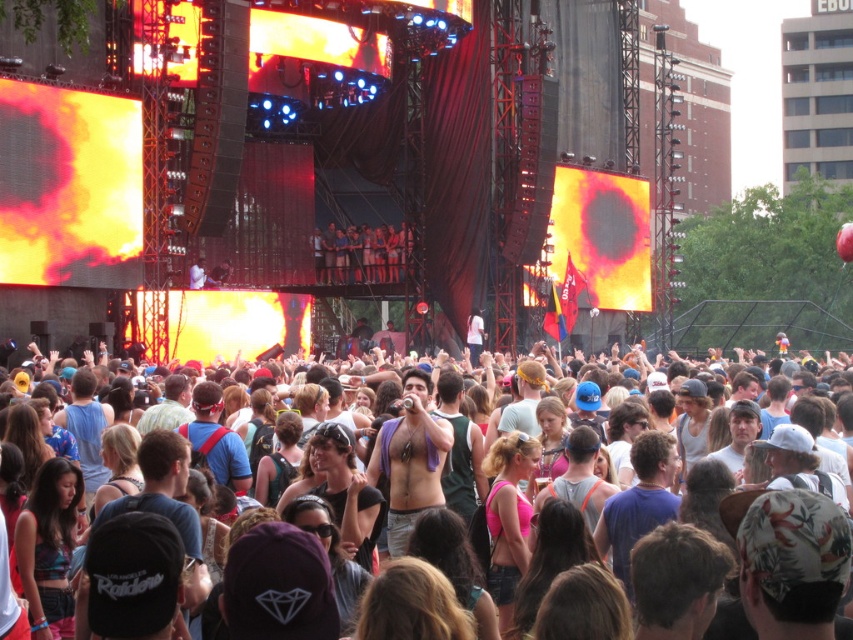
You are a photographer at the concert and want to take a photo of the multicolored casual attire at center and the matte black camera at upper center. Which object should you focus on first if you want to capture both in a single shot without moving the camera?

The multicolored casual attire at center is taller than the matte black camera at upper center, so you should focus on the multicolored casual attire at center first to ensure both objects are in frame.

From the picture: You are a photographer standing at the position of the matte black camera at upper center. You want to capture a photo of the multicolored casual attire at center. Given that your camera has a maximum zoom range of 100 feet, can you clearly capture the subject without moving closer?

The distance between the matte black camera at upper center and the multicolored casual attire at center is 124.46 feet. Since the camera can only zoom up to 100 feet, it cannot clearly capture the subject without moving closer.